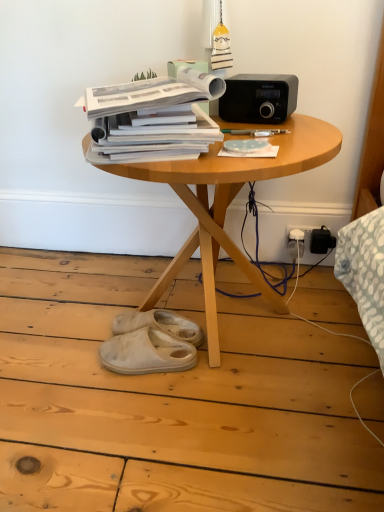
Identify the location of free spot in front of blue dotted paper at center, positioned as the first paperback book in right-to-left order. Image resolution: width=384 pixels, height=512 pixels. [x=249, y=169].